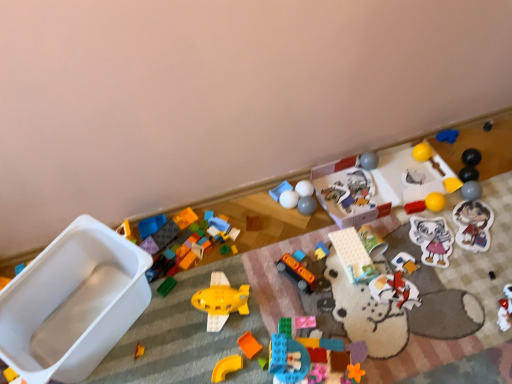
At what (x,y) coordinates should I click in order to perform the action: click on free space between orange plastic block at lower left, acting as the 23th toy starting from the right, and yellow plastic airplane at center, placed as the fourth toy when sorted from left to right. Please return your answer as a coordinate pair (x, y). Looking at the image, I should click on (177, 331).